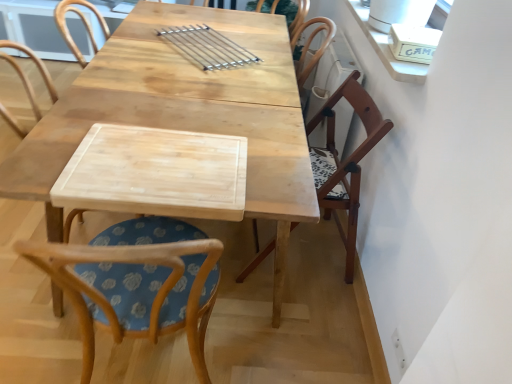
Question: From the image's perspective, does wooden chair with floral cushion at center, arranged as the second chair when viewed from the right, appear higher than wooden chair at right, which appears as the 1th chair when viewed from the right?

Choices:
 (A) no
 (B) yes

Answer: (A)

Question: Are wooden chair with floral cushion at center, the first chair positioned from the left, and wooden chair at right, which ranks as the 2th chair in left-to-right order, located far from each other?

Choices:
 (A) no
 (B) yes

Answer: (A)

Question: Can you confirm if wooden chair with floral cushion at center, arranged as the second chair when viewed from the right, is positioned to the right of wooden chair at right, which appears as the 1th chair when viewed from the right?

Choices:
 (A) no
 (B) yes

Answer: (A)

Question: Is wooden chair with floral cushion at center, arranged as the second chair when viewed from the right, oriented away from wooden chair at right, which appears as the 1th chair when viewed from the right?

Choices:
 (A) no
 (B) yes

Answer: (A)

Question: Can you confirm if wooden chair with floral cushion at center, the first chair positioned from the left, is positioned to the left of wooden chair at right, which ranks as the 2th chair in left-to-right order?

Choices:
 (A) no
 (B) yes

Answer: (B)

Question: From a real-world perspective, is wooden chair with floral cushion at center, arranged as the second chair when viewed from the right, over wooden chair at right, which ranks as the 2th chair in left-to-right order?

Choices:
 (A) no
 (B) yes

Answer: (B)

Question: From a real-world perspective, is wooden chair with floral cushion at center, the first chair positioned from the left, located beneath natural wood table at center?

Choices:
 (A) yes
 (B) no

Answer: (B)

Question: Is wooden chair with floral cushion at center, the first chair positioned from the left, at the left side of natural wood table at center?

Choices:
 (A) yes
 (B) no

Answer: (A)

Question: Is wooden chair with floral cushion at center, the first chair positioned from the left, behind natural wood table at center?

Choices:
 (A) no
 (B) yes

Answer: (A)

Question: From the image's perspective, would you say wooden chair with floral cushion at center, the first chair positioned from the left, is positioned over natural wood table at center?

Choices:
 (A) no
 (B) yes

Answer: (A)

Question: Does wooden chair with floral cushion at center, arranged as the second chair when viewed from the right, touch natural wood table at center?

Choices:
 (A) yes
 (B) no

Answer: (B)

Question: Does wooden chair with floral cushion at center, the first chair positioned from the left, lie in front of natural wood table at center?

Choices:
 (A) yes
 (B) no

Answer: (A)

Question: Can you confirm if wooden chair at right, which appears as the 1th chair when viewed from the right, is shorter than wooden chair with floral cushion at center, the first chair positioned from the left?

Choices:
 (A) yes
 (B) no

Answer: (A)